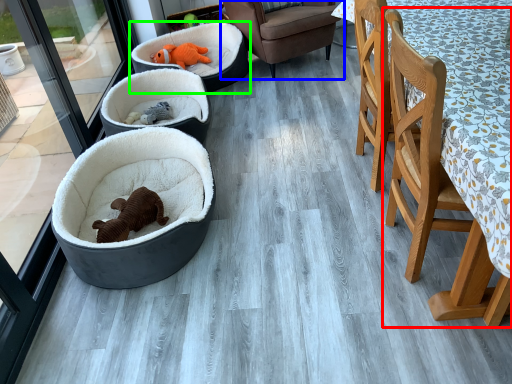
Question: Which object is positioned closest to chair (highlighted by a red box)? Select from chair (highlighted by a blue box) and dog bed (highlighted by a green box).

Choices:
 (A) chair
 (B) dog bed

Answer: (A)